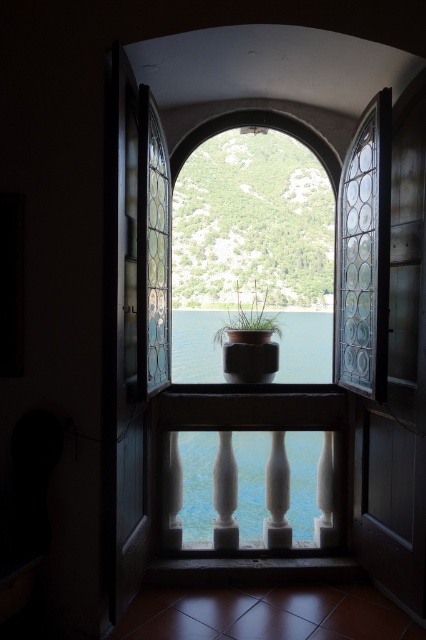
You are a delivery person who needs to place a small package on the windowsill. The package is 10 cm wide. You see the blue glass water at center and the green matte pot at center. Which object should you place the package next to so it fits without overlapping?

The blue glass water at center is positioned on the right side of green matte pot at center. Since the package is 10 cm wide, placing it next to the green matte pot at center on the left side would ensure there is enough space without overlapping with the blue glass water at center.

You are a delivery robot that is 2 meters wide. You are in a room with an open window and see the blue glass water at center. There is a door on the other side of the room. Can you move from the window to the door without hitting any walls?

The distance between the blue glass water at center and the door is 6.37 meters. Since the robot is 2 meters wide, it can navigate through the space as long as the path is wide enough. However, the description only mentions the distance between them, not the width of the path. Therefore, it is uncertain if the robot can move without hitting walls.

You are standing in the room and want to place a small potted plant on the windowsill. The windowsill is located at the point where the blue glass water at center is represented by point (305, 346). Is there enough space to place the plant there?

The blue glass water at center is represented by point (305, 346) indicates the location of the windowsill. Since the small potted plant is already placed there, there is no space left to place another plant.